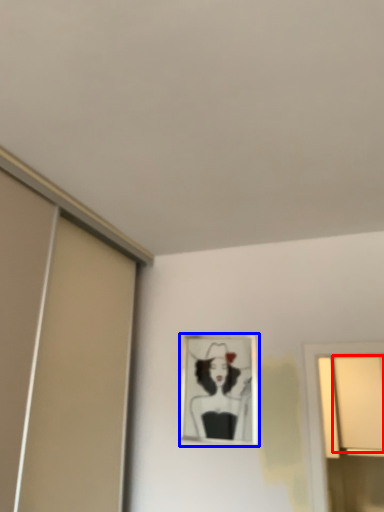
Question: Which of the following is the farthest to the observer, window (highlighted by a red box) or picture frame (highlighted by a blue box)?

Choices:
 (A) window
 (B) picture frame

Answer: (A)